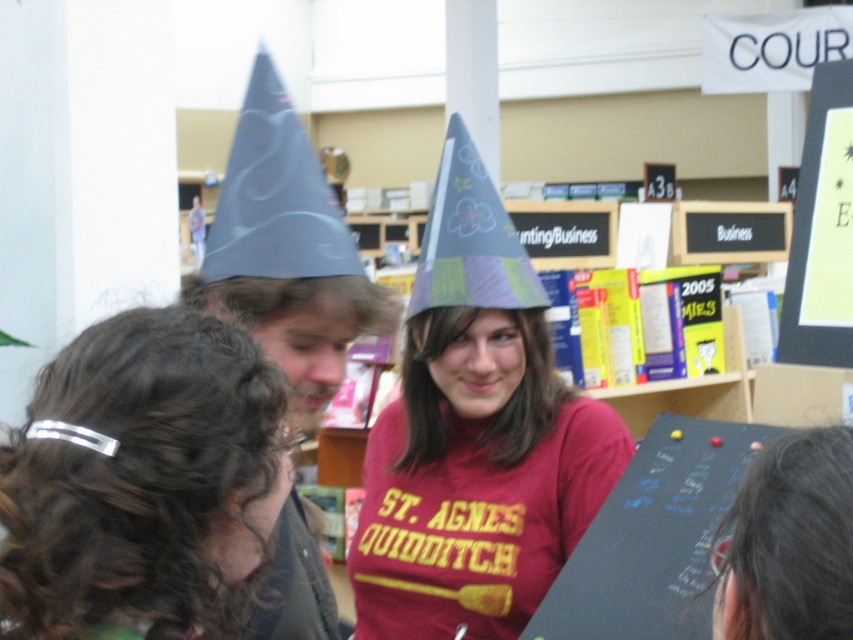
Question: Where is dark brown hair at lower right located in relation to matte blue paper party hat at upper center in the image?

Choices:
 (A) below
 (B) above

Answer: (A)

Question: Does matte purple party hat at center appear under matte blue paper party hat at upper center?

Choices:
 (A) no
 (B) yes

Answer: (B)

Question: Does silver metallic hair clip at center have a lesser width compared to matte black sign at upper right?

Choices:
 (A) no
 (B) yes

Answer: (A)

Question: Which point is closer to the camera taking this photo?

Choices:
 (A) (387, 435)
 (B) (448, 296)
 (C) (239, 442)

Answer: (C)

Question: Which object is closer to the camera taking this photo?

Choices:
 (A) matte blue paper party hat at upper center
 (B) blue fabric party hat at center

Answer: (A)

Question: Which of these objects is positioned farthest from the black chalkboard at center?

Choices:
 (A) matte purple party hat at center
 (B) matte blue paper party hat at upper center

Answer: (B)